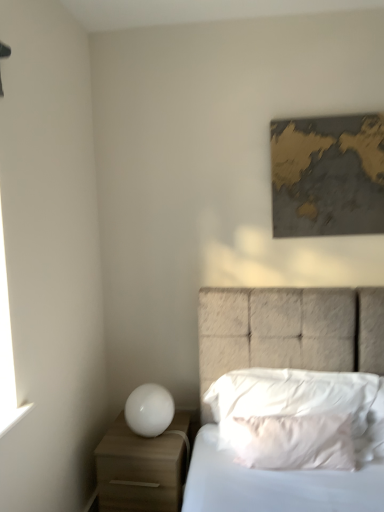
Question: From a real-world perspective, is white glossy sphere at lower left located higher than textured fabric bed at center?

Choices:
 (A) no
 (B) yes

Answer: (B)

Question: From the image's perspective, does white glossy sphere at lower left appear lower than textured fabric bed at center?

Choices:
 (A) yes
 (B) no

Answer: (B)

Question: Does white glossy sphere at lower left have a smaller size compared to textured fabric bed at center?

Choices:
 (A) yes
 (B) no

Answer: (A)

Question: Considering the relative positions of white glossy sphere at lower left and textured fabric bed at center in the image provided, is white glossy sphere at lower left behind textured fabric bed at center?

Choices:
 (A) yes
 (B) no

Answer: (A)

Question: Would you say white glossy sphere at lower left contains textured fabric bed at center?

Choices:
 (A) no
 (B) yes

Answer: (A)

Question: In terms of height, does white soft pillow at center, placed as the 2th pillow when sorted from front to back, look taller or shorter compared to white matte nightstand at lower left?

Choices:
 (A) short
 (B) tall

Answer: (A)

Question: In terms of size, does white soft pillow at center, placed as the 2th pillow when sorted from front to back, appear bigger or smaller than white matte nightstand at lower left?

Choices:
 (A) small
 (B) big

Answer: (A)

Question: From a real-world perspective, relative to white matte nightstand at lower left, is white soft pillow at center, the 1th pillow in the back-to-front sequence, vertically above or below?

Choices:
 (A) above
 (B) below

Answer: (A)

Question: Does point (264, 375) appear closer or farther from the camera than point (173, 458)?

Choices:
 (A) closer
 (B) farther

Answer: (B)

Question: From a real-world perspective, relative to white soft pillow at center, the 2th pillow positioned from the back, is white soft pillow at center, placed as the 2th pillow when sorted from front to back, vertically above or below?

Choices:
 (A) below
 (B) above

Answer: (B)

Question: Considering the positions of white soft pillow at center, the 1th pillow in the back-to-front sequence, and white soft pillow at center, the 2th pillow positioned from the back, in the image, is white soft pillow at center, the 1th pillow in the back-to-front sequence, wider or thinner than white soft pillow at center, the 2th pillow positioned from the back,?

Choices:
 (A) thin
 (B) wide

Answer: (B)

Question: Visually, is white soft pillow at center, the 1th pillow in the back-to-front sequence, positioned to the left or to the right of white soft pillow at center, placed as the first pillow when sorted from front to back?

Choices:
 (A) left
 (B) right

Answer: (B)

Question: Is white soft pillow at center, placed as the 2th pillow when sorted from front to back, bigger or smaller than white soft pillow at center, the 2th pillow positioned from the back?

Choices:
 (A) big
 (B) small

Answer: (A)

Question: Considering the positions of white glossy sphere at lower left and textured fabric bed at center in the image, is white glossy sphere at lower left taller or shorter than textured fabric bed at center?

Choices:
 (A) tall
 (B) short

Answer: (B)

Question: In terms of width, does white glossy sphere at lower left look wider or thinner when compared to textured fabric bed at center?

Choices:
 (A) thin
 (B) wide

Answer: (A)